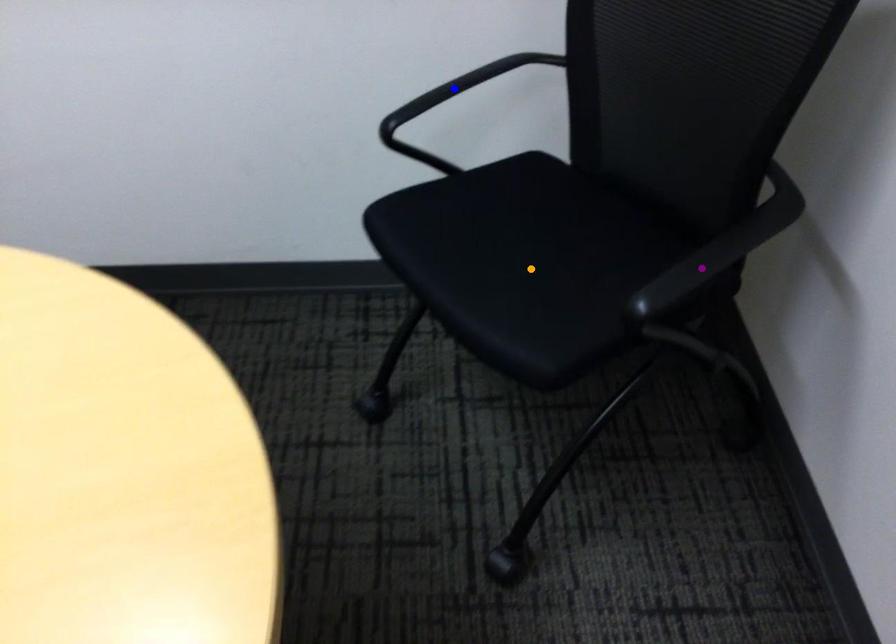
Order these from nearest to farthest:
purple point, blue point, orange point

purple point, orange point, blue point